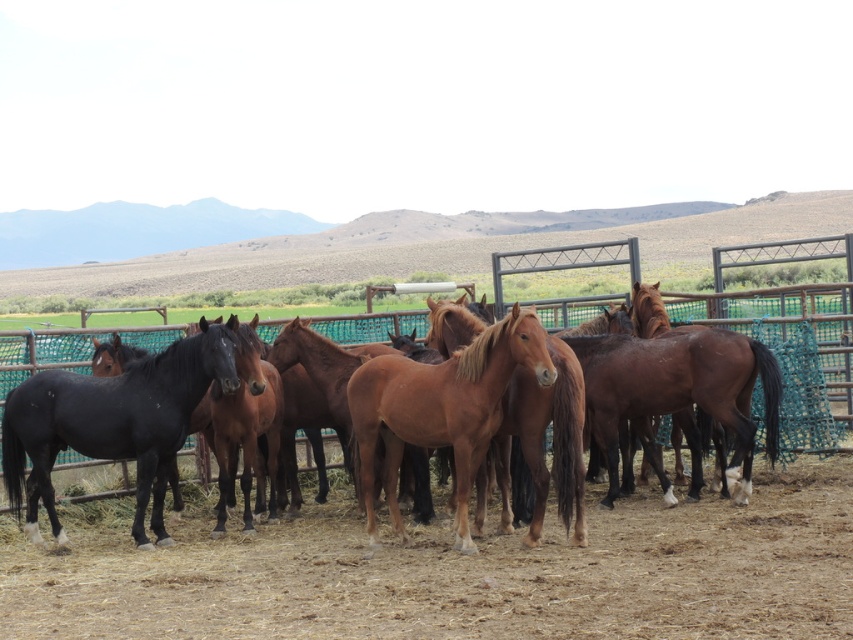
Can you confirm if brown dry dirt at center is thinner than brown glossy horse at center?

Indeed, brown dry dirt at center has a lesser width compared to brown glossy horse at center.

Is point (547, 577) positioned before point (381, 368)?

Yes.

The image size is (853, 640). What do you see at coordinates (459, 573) in the screenshot? I see `brown dry dirt at center` at bounding box center [459, 573].

Image resolution: width=853 pixels, height=640 pixels. Identify the location of brown dry dirt at center. (459, 573).

Can you confirm if shiny brown horse at center is positioned to the left of brown glossy horse at center?

Correct, you'll find shiny brown horse at center to the left of brown glossy horse at center.

Which is below, shiny brown horse at center or brown glossy horse at center?

shiny brown horse at center is lower down.

Describe the element at coordinates (112, 422) in the screenshot. I see `shiny brown horse at center` at that location.

I want to click on shiny brown horse at center, so click(112, 422).

Is shiny brown horse at center positioned behind shiny black horse at left?

Yes, it is behind shiny black horse at left.

Between point (347, 380) and point (144, 445), which one is positioned in front?

Point (144, 445)

Describe the element at coordinates (112, 422) in the screenshot. This screenshot has width=853, height=640. I see `shiny brown horse at center` at that location.

The height and width of the screenshot is (640, 853). In order to click on shiny brown horse at center in this screenshot , I will do `click(112, 422)`.